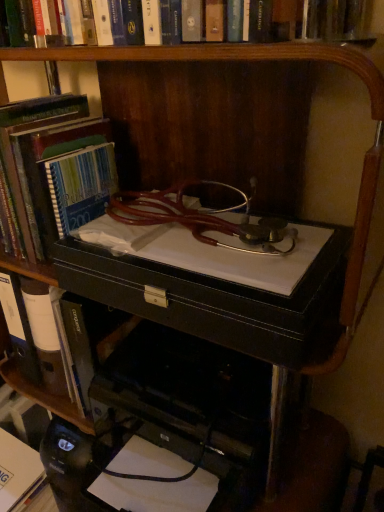
What do you see at coordinates (43, 333) in the screenshot? I see `black leather book at center, marked as the 2th book in a bottom-to-top arrangement` at bounding box center [43, 333].

Identify the location of black leather book at center, arranged as the 2th book when viewed from the top. (43, 333).

Find the location of a particular element. blue striped notebook at center, the 1th book in the top-to-bottom sequence is located at coordinates (63, 178).

Measure the distance between black leather drawer at center and camera.

black leather drawer at center is 20.21 inches away from camera.

What do you see at coordinates (219, 298) in the screenshot?
I see `black leather drawer at center` at bounding box center [219, 298].

Measure the distance between white paper at lower left, which ranks as the first book in bottom-to-top order, and camera.

white paper at lower left, which ranks as the first book in bottom-to-top order, is 39.33 inches from camera.

The image size is (384, 512). I want to click on black leather book at center, marked as the 2th book in a bottom-to-top arrangement, so (43, 333).

Does blue striped notebook at center, the 1th book in the top-to-bottom sequence, have a smaller size compared to white paper at lower left, which ranks as the first book in bottom-to-top order?

No.

Which is in front, blue striped notebook at center, which appears as the 3th book when ordered from the bottom, or white paper at lower left, marked as the third book in a top-to-bottom arrangement?

blue striped notebook at center, which appears as the 3th book when ordered from the bottom, is more forward.

Does blue striped notebook at center, the 1th book in the top-to-bottom sequence, appear on the right side of white paper at lower left, which ranks as the first book in bottom-to-top order?

Yes.

Is white paper at lower left, marked as the third book in a top-to-bottom arrangement, taller or shorter than black leather drawer at center?

Clearly, white paper at lower left, marked as the third book in a top-to-bottom arrangement, is taller compared to black leather drawer at center.

Does point (36, 457) come farther from viewer compared to point (276, 356)?

Yes, point (36, 457) is behind point (276, 356).

From the image's perspective, is white paper at lower left, which ranks as the first book in bottom-to-top order, located above or below black leather drawer at center?

From the image's perspective, white paper at lower left, which ranks as the first book in bottom-to-top order, appears below black leather drawer at center.

Is white paper at lower left, marked as the third book in a top-to-bottom arrangement, placed right next to black leather drawer at center?

white paper at lower left, marked as the third book in a top-to-bottom arrangement, and black leather drawer at center are not in contact.

Is black leather book at center, marked as the 2th book in a bottom-to-top arrangement, oriented away from black leather computer desk at center?

No, black leather book at center, marked as the 2th book in a bottom-to-top arrangement, is not facing away from black leather computer desk at center.

In the image, is black leather book at center, marked as the 2th book in a bottom-to-top arrangement, positioned in front of or behind black leather computer desk at center?

In the image, black leather book at center, marked as the 2th book in a bottom-to-top arrangement, appears behind black leather computer desk at center.

Looking at this image, can you confirm if black leather book at center, arranged as the 2th book when viewed from the top, is taller than black leather computer desk at center?

Correct, black leather book at center, arranged as the 2th book when viewed from the top, is much taller as black leather computer desk at center.

Does black leather book at center, arranged as the 2th book when viewed from the top, appear on the right side of black leather computer desk at center?

In fact, black leather book at center, arranged as the 2th book when viewed from the top, is to the left of black leather computer desk at center.

Considering the positions of objects black leather drawer at center and black leather book at center, arranged as the 2th book when viewed from the top, in the image provided, who is more to the right, black leather drawer at center or black leather book at center, arranged as the 2th book when viewed from the top,?

Positioned to the right is black leather drawer at center.

Considering the relative positions of black leather drawer at center and black leather book at center, marked as the 2th book in a bottom-to-top arrangement, in the image provided, is black leather drawer at center behind black leather book at center, marked as the 2th book in a bottom-to-top arrangement,?

That is False.

Considering the sizes of objects black leather drawer at center and black leather book at center, arranged as the 2th book when viewed from the top, in the image provided, who is bigger, black leather drawer at center or black leather book at center, arranged as the 2th book when viewed from the top,?

black leather drawer at center.

Is black leather drawer at center in contact with black leather book at center, marked as the 2th book in a bottom-to-top arrangement?

No, black leather drawer at center is not beside black leather book at center, marked as the 2th book in a bottom-to-top arrangement.

Based on the photo, what's the angular difference between black leather drawer at center and blue striped notebook at center, the 1th book in the top-to-bottom sequence,'s facing directions?

They differ by 5.36 degrees in their facing directions.

Looking at this image, from a real-world perspective, is black leather drawer at center positioned above or below blue striped notebook at center, the 1th book in the top-to-bottom sequence?

In terms of real-world spatial position, black leather drawer at center is below blue striped notebook at center, the 1th book in the top-to-bottom sequence.

Are black leather drawer at center and blue striped notebook at center, the 1th book in the top-to-bottom sequence, located far from each other?

That's not correct — black leather drawer at center is a little close to blue striped notebook at center, the 1th book in the top-to-bottom sequence.

Considering the positions of point (197, 300) and point (83, 98), is point (197, 300) closer or farther from the camera than point (83, 98)?

Point (197, 300) appears to be closer to the viewer than point (83, 98).

Which of these two, black leather computer desk at center or blue striped notebook at center, the 1th book in the top-to-bottom sequence, is wider?

black leather computer desk at center.

From the image's perspective, between black leather computer desk at center and blue striped notebook at center, which appears as the 3th book when ordered from the bottom, who is located below?

black leather computer desk at center is shown below in the image.

Considering the sizes of objects black leather computer desk at center and blue striped notebook at center, which appears as the 3th book when ordered from the bottom, in the image provided, who is bigger, black leather computer desk at center or blue striped notebook at center, which appears as the 3th book when ordered from the bottom,?

black leather computer desk at center.

Looking at their sizes, would you say black leather book at center, marked as the 2th book in a bottom-to-top arrangement, is wider or thinner than blue striped notebook at center, which appears as the 3th book when ordered from the bottom?

Considering their sizes, black leather book at center, marked as the 2th book in a bottom-to-top arrangement, looks slimmer than blue striped notebook at center, which appears as the 3th book when ordered from the bottom.

Is black leather book at center, arranged as the 2th book when viewed from the top, surrounding blue striped notebook at center, the 1th book in the top-to-bottom sequence?

No.

Can you confirm if black leather book at center, marked as the 2th book in a bottom-to-top arrangement, is positioned to the left of blue striped notebook at center, which appears as the 3th book when ordered from the bottom?

Yes.

How different are the orientations of black leather book at center, arranged as the 2th book when viewed from the top, and blue striped notebook at center, which appears as the 3th book when ordered from the bottom, in degrees?

4.95 degrees.

Where is `book that is the 2nd one below the blue striped notebook at center, the 1th book in the top-to-bottom sequence (from a real-world perspective)`? This screenshot has width=384, height=512. book that is the 2nd one below the blue striped notebook at center, the 1th book in the top-to-bottom sequence (from a real-world perspective) is located at coordinates (21, 458).

Where is `the 3rd book to the left when counting from the black leather drawer at center`? The width and height of the screenshot is (384, 512). the 3rd book to the left when counting from the black leather drawer at center is located at coordinates (21, 458).

Which object lies nearer to the anchor point black leather drawer at center, blue striped notebook at center, the 1th book in the top-to-bottom sequence, or black leather book at center, marked as the 2th book in a bottom-to-top arrangement?

blue striped notebook at center, the 1th book in the top-to-bottom sequence, lies closer to black leather drawer at center than the other object.

When comparing their distances from black leather book at center, arranged as the 2th book when viewed from the top, does black leather computer desk at center or black leather drawer at center seem closer?

black leather drawer at center is closer to black leather book at center, arranged as the 2th book when viewed from the top.

Estimate the real-world distances between objects in this image. Which object is closer to black leather computer desk at center, black leather book at center, marked as the 2th book in a bottom-to-top arrangement, or black leather drawer at center?

black leather drawer at center.

From the image, which object appears to be farther from black leather drawer at center, blue striped notebook at center, which appears as the 3th book when ordered from the bottom, or white paper at lower left, marked as the third book in a top-to-bottom arrangement?

Among the two, white paper at lower left, marked as the third book in a top-to-bottom arrangement, is located further to black leather drawer at center.

From the image, which object appears to be nearer to black leather computer desk at center, black leather book at center, arranged as the 2th book when viewed from the top, or white paper at lower left, marked as the third book in a top-to-bottom arrangement?

Among the two, black leather book at center, arranged as the 2th book when viewed from the top, is located nearer to black leather computer desk at center.

When comparing their distances from white paper at lower left, marked as the third book in a top-to-bottom arrangement, does black leather computer desk at center or blue striped notebook at center, which appears as the 3th book when ordered from the bottom, seem further?

Based on the image, black leather computer desk at center appears to be further to white paper at lower left, marked as the third book in a top-to-bottom arrangement.

Estimate the real-world distances between objects in this image. Which object is further from white paper at lower left, which ranks as the first book in bottom-to-top order, blue striped notebook at center, which appears as the 3th book when ordered from the bottom, or black leather computer desk at center?

black leather computer desk at center is further to white paper at lower left, which ranks as the first book in bottom-to-top order.

From the image, which object appears to be nearer to white paper at lower left, which ranks as the first book in bottom-to-top order, black leather drawer at center or black leather book at center, marked as the 2th book in a bottom-to-top arrangement?

black leather book at center, marked as the 2th book in a bottom-to-top arrangement, is closer to white paper at lower left, which ranks as the first book in bottom-to-top order.

Where is `drawer that lies between blue striped notebook at center, the 1th book in the top-to-bottom sequence, and black leather computer desk at center from top to bottom`? drawer that lies between blue striped notebook at center, the 1th book in the top-to-bottom sequence, and black leather computer desk at center from top to bottom is located at coordinates (219, 298).

Where is `book between black leather drawer at center and black leather book at center, marked as the 2th book in a bottom-to-top arrangement, in the front-back direction`? This screenshot has width=384, height=512. book between black leather drawer at center and black leather book at center, marked as the 2th book in a bottom-to-top arrangement, in the front-back direction is located at coordinates (63, 178).

At what (x,y) coordinates should I click in order to perform the action: click on book between black leather drawer at center and white paper at lower left, which ranks as the first book in bottom-to-top order, from top to bottom. Please return your answer as a coordinate pair (x, y). The width and height of the screenshot is (384, 512). Looking at the image, I should click on (43, 333).

At what (x,y) coordinates should I click in order to perform the action: click on computer desk positioned between black leather drawer at center and black leather book at center, arranged as the 2th book when viewed from the top, from near to far. Please return your answer as a coordinate pair (x, y). The height and width of the screenshot is (512, 384). Looking at the image, I should click on (222, 293).